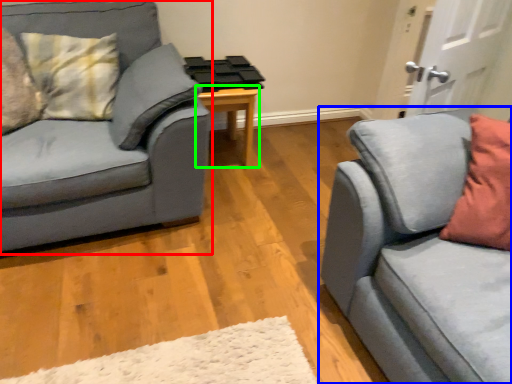
Question: Based on their relative distances, which object is farther from studio couch (highlighted by a red box)? Choose from studio couch (highlighted by a blue box) and table (highlighted by a green box).

Choices:
 (A) studio couch
 (B) table

Answer: (A)